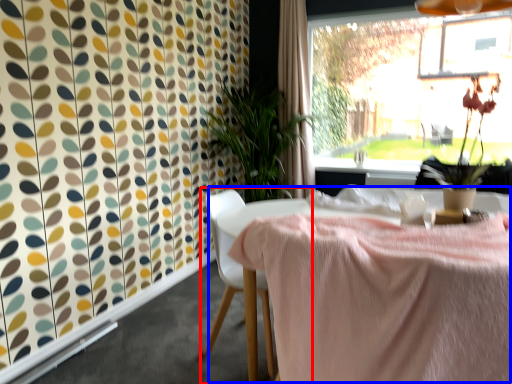
Question: Which point is closer to the camera, chair (highlighted by a red box) or table (highlighted by a blue box)?

Choices:
 (A) chair
 (B) table

Answer: (B)